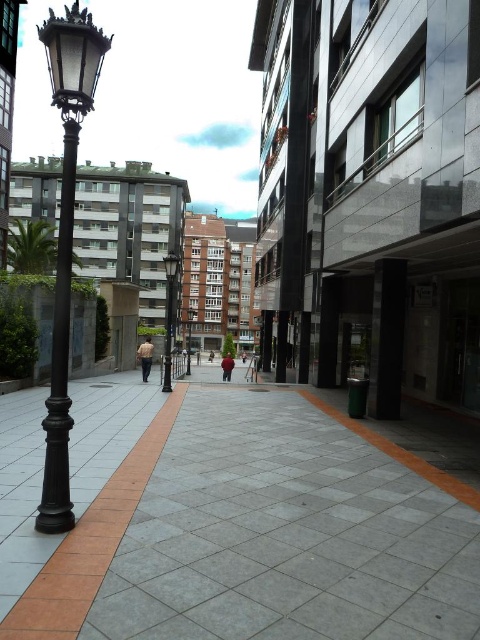
Question: Is polished brass streetlight at center closer to the viewer compared to dark blue jeans at center?

Choices:
 (A) yes
 (B) no

Answer: (A)

Question: Among these points, which one is farthest from the camera?

Choices:
 (A) (229, 378)
 (B) (60, 312)
 (C) (59, 499)
 (D) (148, 342)

Answer: (A)

Question: Which of the following is the closest to the observer?

Choices:
 (A) black polished pole at left
 (B) matte black lamp post at left
 (C) red cotton shirt at center

Answer: (B)

Question: Considering the relative positions of dark blue jeans at center and dark brown leather jacket at center in the image provided, where is dark blue jeans at center located with respect to dark brown leather jacket at center?

Choices:
 (A) above
 (B) below

Answer: (A)

Question: Which object is the farthest from the dark blue jeans at center?

Choices:
 (A) dark brown leather jacket at center
 (B) black polished pole at left
 (C) light brown shirt at center

Answer: (B)

Question: In this image, where is red cotton shirt at center located relative to dark brown leather jacket at center?

Choices:
 (A) below
 (B) above

Answer: (B)